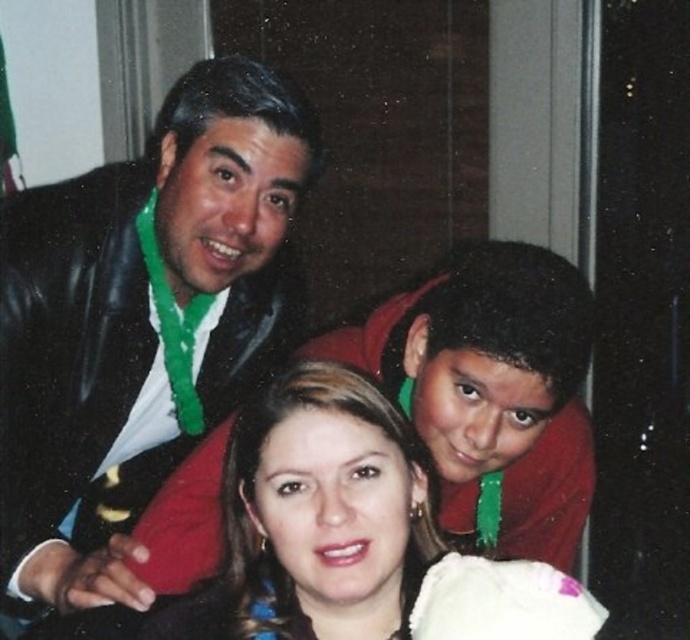
Which of these two, matte black jacket at upper left or smooth skin face at center, stands shorter?

With less height is smooth skin face at center.

Is point (63, 465) closer to camera compared to point (175, 620)?

No, it is behind (175, 620).

Identify the location of matte black jacket at upper left. Image resolution: width=690 pixels, height=640 pixels. (138, 323).